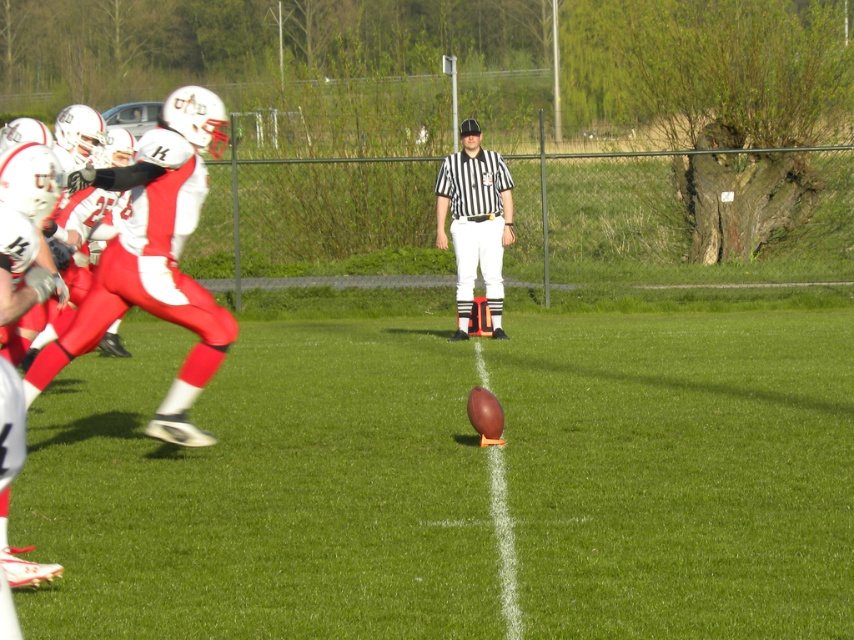
Question: Does white matte uniform at left have a smaller size compared to black striped shirt at center?

Choices:
 (A) yes
 (B) no

Answer: (B)

Question: Is brown leather football at center closer to camera compared to white matte uniform at left?

Choices:
 (A) no
 (B) yes

Answer: (B)

Question: Among these objects, which one is nearest to the camera?

Choices:
 (A) white matte uniform at left
 (B) brown leather football at center
 (C) black striped shirt at center

Answer: (B)

Question: Which object appears closest to the camera in this image?

Choices:
 (A) black striped shirt at center
 (B) brown leather football at center
 (C) white matte uniform at left

Answer: (B)

Question: Can you confirm if brown leather football at center is positioned above black striped shirt at center?

Choices:
 (A) no
 (B) yes

Answer: (A)

Question: Which object is farther from the camera taking this photo?

Choices:
 (A) brown leather football at center
 (B) black striped shirt at center

Answer: (B)